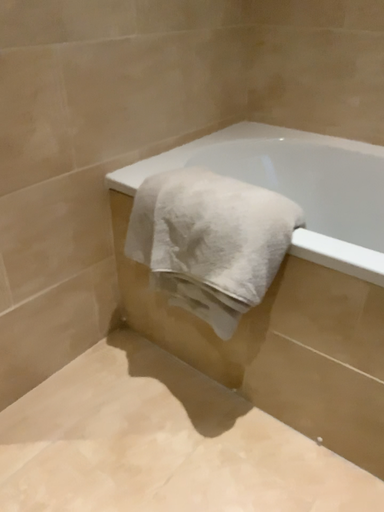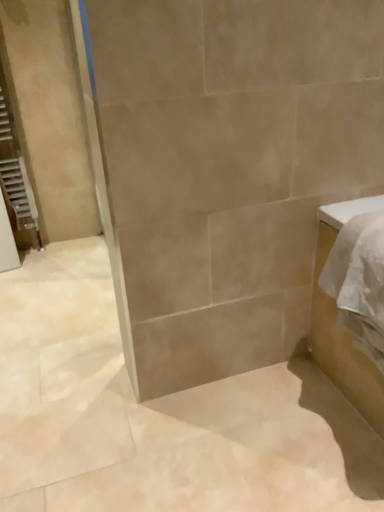
Question: How did the camera likely rotate when shooting the video?

Choices:
 (A) rotated right
 (B) rotated left

Answer: (B)